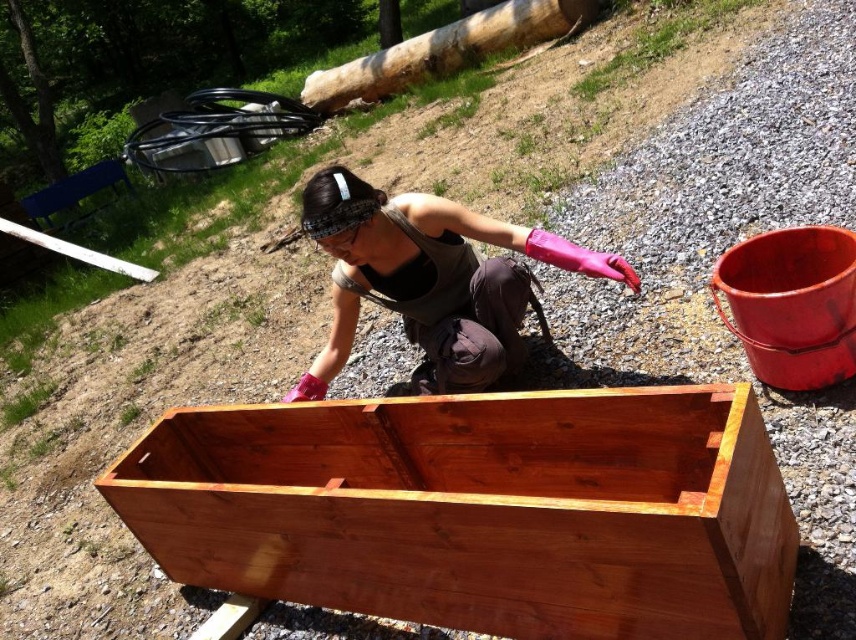
Who is higher up, shiny brown wood crate at center or pink rubber gloves at center?

Positioned higher is pink rubber gloves at center.

Is shiny brown wood crate at center below pink rubber gloves at center?

Yes, shiny brown wood crate at center is below pink rubber gloves at center.

Is point (307, 451) more distant than point (370, 211)?

Yes, point (307, 451) is behind point (370, 211).

Locate an element on the screen. shiny brown wood crate at center is located at coordinates (479, 509).